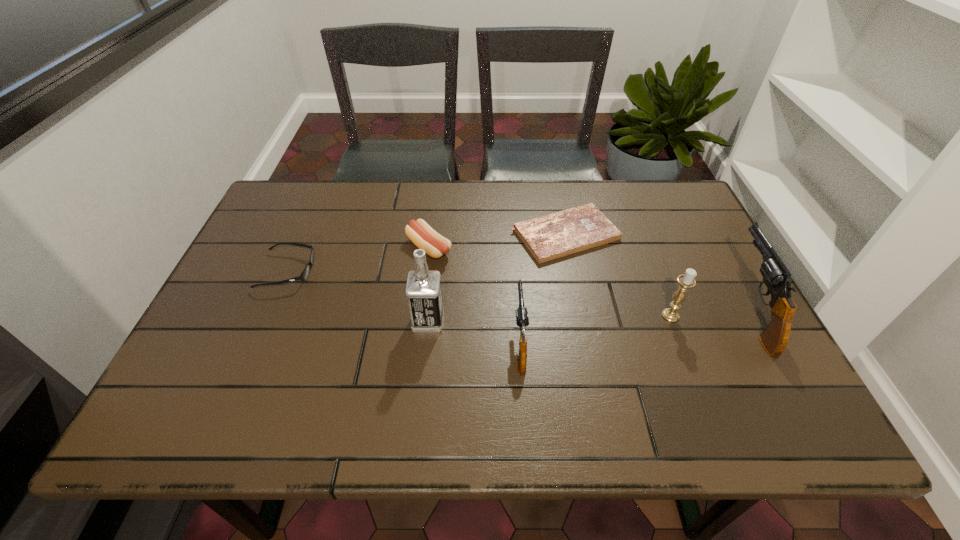
Please point a free position for a gun on the left. Please provide its 2D coordinates. Your answer should be formatted as a tuple, i.e. [(x, y)], where the tuple contains the x and y coordinates of a point satisfying the conditions above.

[(259, 376)]